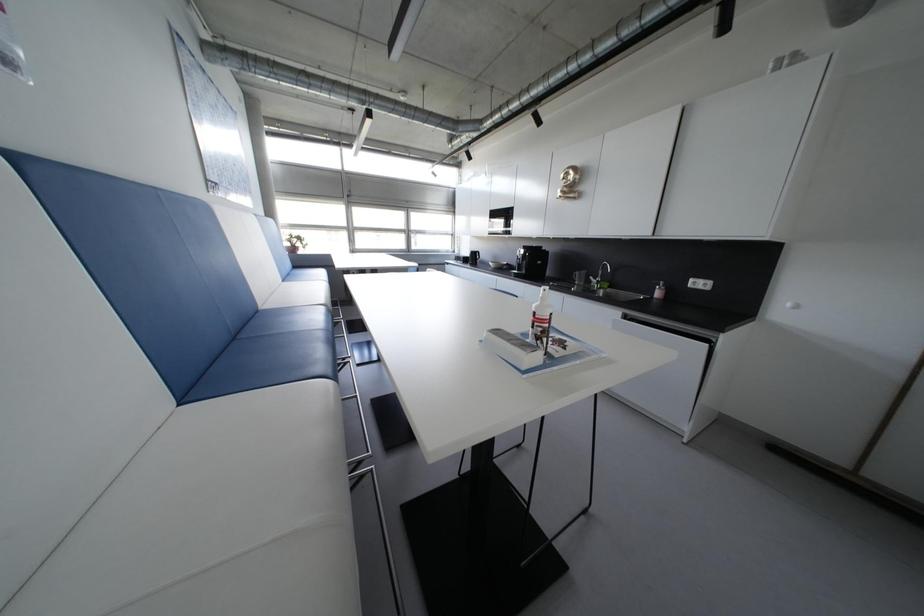
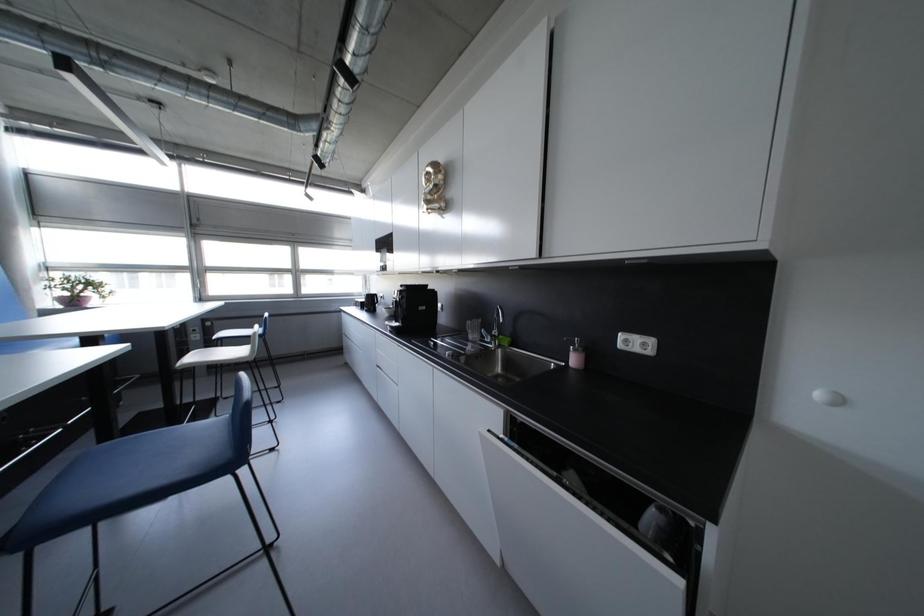
The images are taken continuously from a first-person perspective. In which direction are you moving?

The cameraman walked toward right, forward.